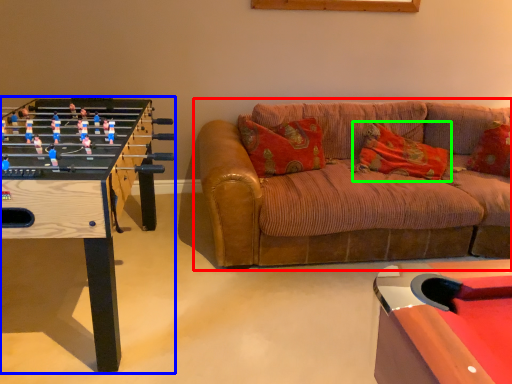
Question: Which object is positioned closest to studio couch (highlighted by a red box)? Select from table (highlighted by a blue box) and pillow (highlighted by a green box).

Choices:
 (A) table
 (B) pillow

Answer: (B)